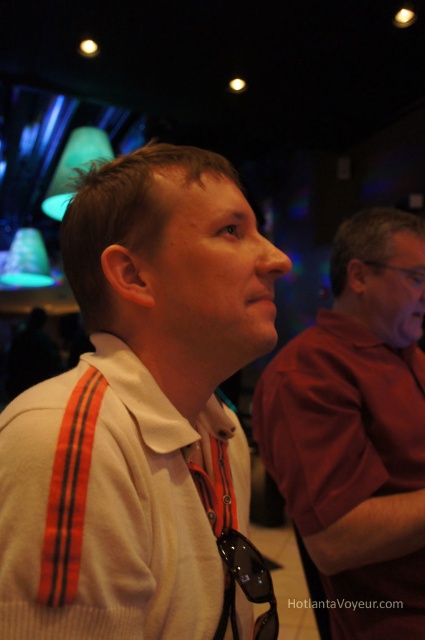
From the picture: Can you confirm if white knit sweater at center is positioned below white matte shirt at center?

No.

Is white knit sweater at center to the right of white matte shirt at center from the viewer's perspective?

In fact, white knit sweater at center is to the left of white matte shirt at center.

Measure the distance between point (113, 396) and camera.

They are 19.52 inches apart.

Identify the location of white knit sweater at center. This screenshot has height=640, width=425. (141, 412).